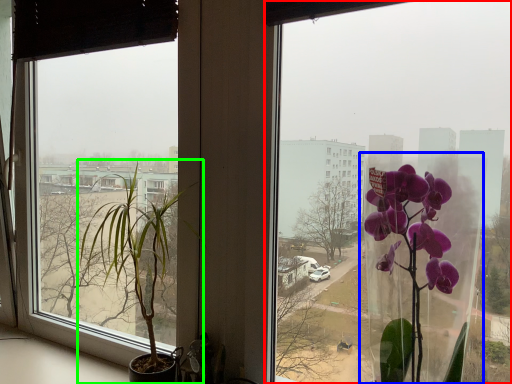
Question: Which object is the farthest from window (highlighted by a red box)? Choose among these: glass vase (highlighted by a blue box) or houseplant (highlighted by a green box).

Choices:
 (A) glass vase
 (B) houseplant

Answer: (B)